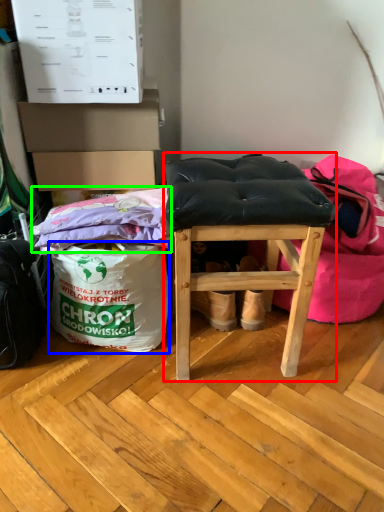
Question: Which object is positioned closest to furniture (highlighted by a red box)? Select from grocery bag (highlighted by a blue box) and material (highlighted by a green box).

Choices:
 (A) grocery bag
 (B) material

Answer: (B)